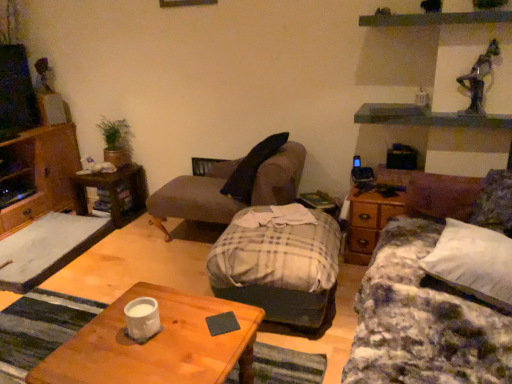
Where is `free space in front of white matte coffee cup at lower left`? The height and width of the screenshot is (384, 512). free space in front of white matte coffee cup at lower left is located at coordinates (x=131, y=361).